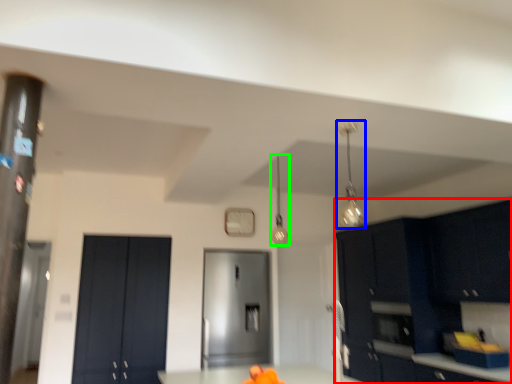
Question: Estimate the real-world distances between objects in this image. Which object is farther from cabinetry (highlighted by a red box), light fixture (highlighted by a blue box) or light fixture (highlighted by a green box)?

Choices:
 (A) light fixture
 (B) light fixture

Answer: (B)